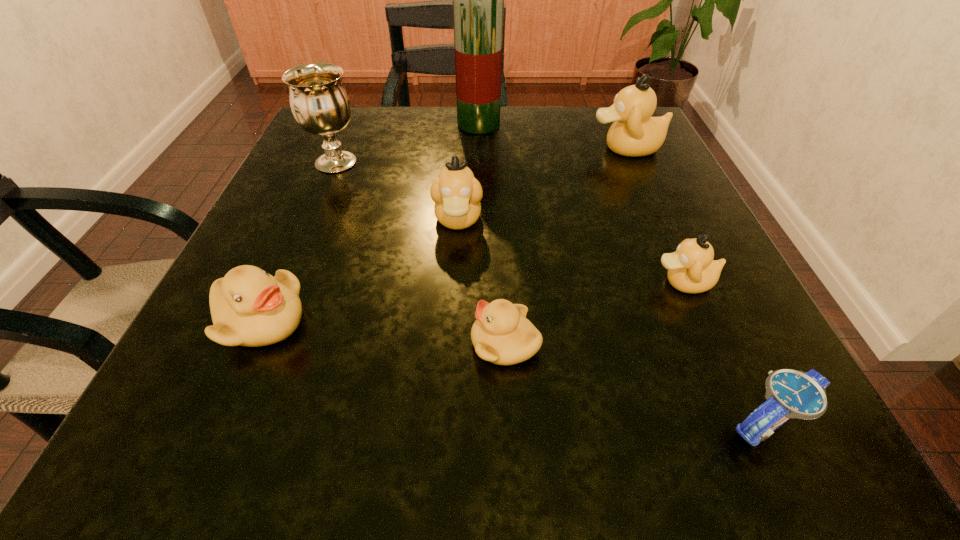
At what (x,y) coordinates should I click in order to perform the action: click on free space between the fifth nearest object and the nearest object. Please return your answer as a coordinate pair (x, y). Looking at the image, I should click on (612, 321).

What are the coordinates of `empty location between the fifth nearest object and the shortest duckling` in the screenshot? It's located at (482, 281).

I want to click on vacant area that lies between the chalice and the second farthest tan duckling, so click(397, 191).

In order to click on empty location between the farthest duckling and the leftmost duckling in this screenshot , I will do `click(444, 235)`.

Identify the location of empty space that is in between the bigger yellow duckling and the liquor. (370, 223).

This screenshot has width=960, height=540. What are the coordinates of `object that is the fifth closest to the nearest tan duckling` in the screenshot? It's located at (478, 0).

This screenshot has height=540, width=960. I want to click on object that is the fifth closest one to the bigger yellow duckling, so click(x=691, y=269).

Select which duckling is the fourth closest to the farthest duckling. Please provide its 2D coordinates. Your answer should be formatted as a tuple, i.e. [(x, y)], where the tuple contains the x and y coordinates of a point satisfying the conditions above.

[(249, 307)]

Locate an element on the screen. duckling that is the closest to the blue watch is located at coordinates (691, 269).

Choose which tan duckling is the nearest neighbor to the tallest duckling. Please provide its 2D coordinates. Your answer should be formatted as a tuple, i.e. [(x, y)], where the tuple contains the x and y coordinates of a point satisfying the conditions above.

[(456, 192)]